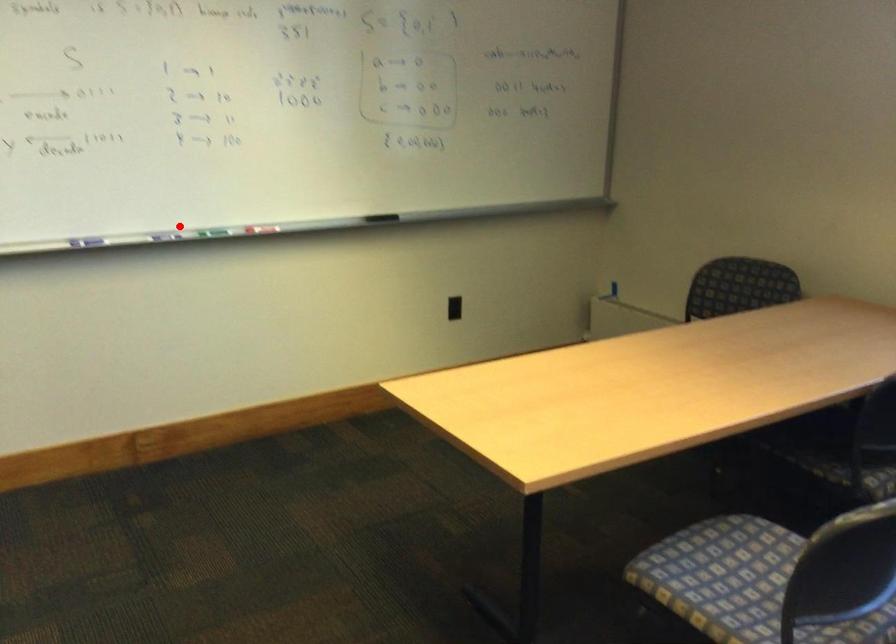
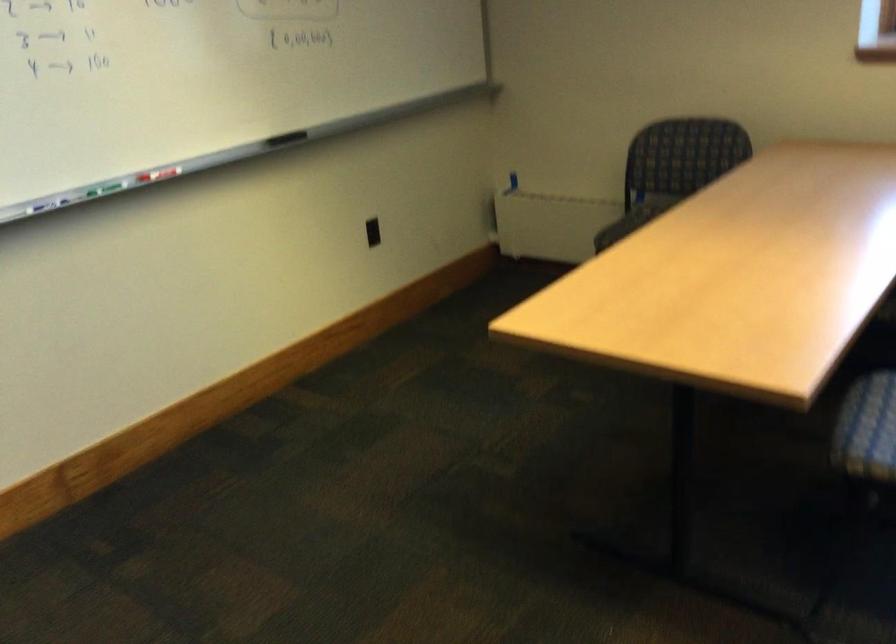
Question: A red point is marked in image1. In image2, is the corresponding 3D point closer to the camera or farther? Reply with the corresponding letter.

Choices:
 (A) The corresponding 3D point is closer.
 (B) The corresponding 3D point is farther.

Answer: (A)